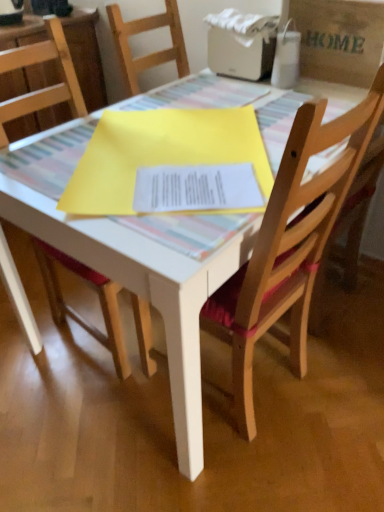
Locate an element on the screen. free spot in front of brown paper bag at upper right is located at coordinates (325, 98).